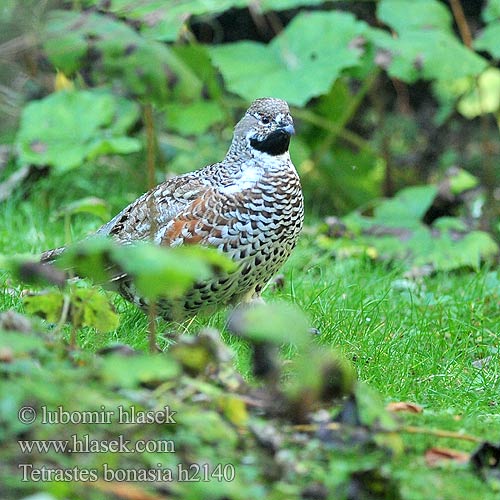
Where is `the chest`? the chest is located at coordinates (292, 212).